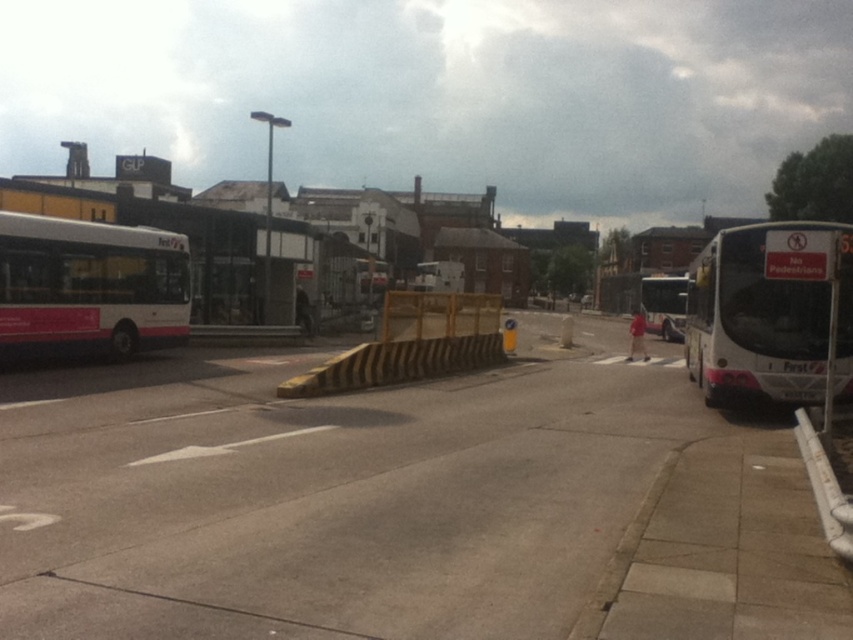
Question: Can you confirm if white plastic curb at lower right is positioned to the left of white matte bus at center?

Choices:
 (A) no
 (B) yes

Answer: (B)

Question: Can you confirm if white matte bus at left is smaller than white plastic curb at lower right?

Choices:
 (A) no
 (B) yes

Answer: (A)

Question: Which of the following is the closest to the observer?

Choices:
 (A) white plastic curb at lower right
 (B) white glossy bus at right

Answer: (A)

Question: Which object is the farthest from the white glossy bus at right?

Choices:
 (A) white plastic curb at lower right
 (B) white matte bus at center
 (C) white matte bus at left

Answer: (B)

Question: In this image, where is white plastic curb at lower right located relative to white matte bus at center?

Choices:
 (A) above
 (B) below

Answer: (B)

Question: Which point appears closest to the camera in this image?

Choices:
 (A) (726, 330)
 (B) (839, 516)

Answer: (B)